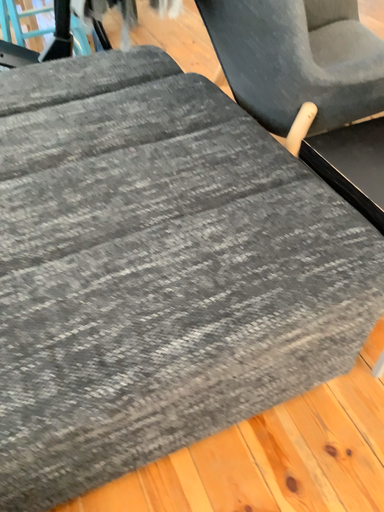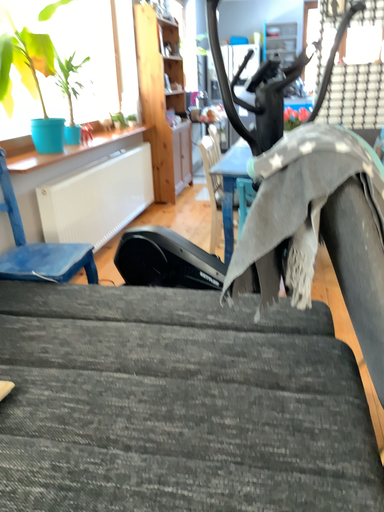
Question: How did the camera likely rotate when shooting the video?

Choices:
 (A) rotated left
 (B) rotated right

Answer: (A)